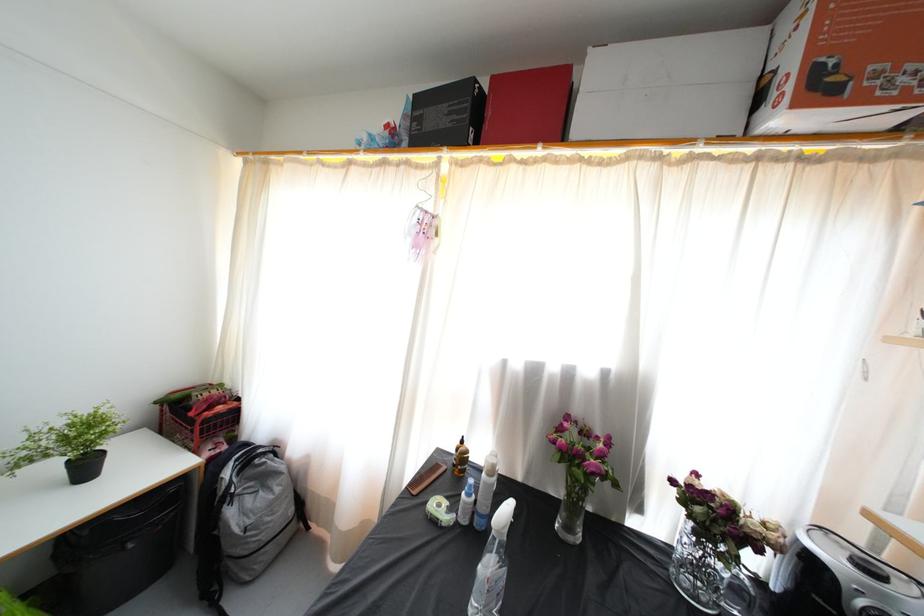
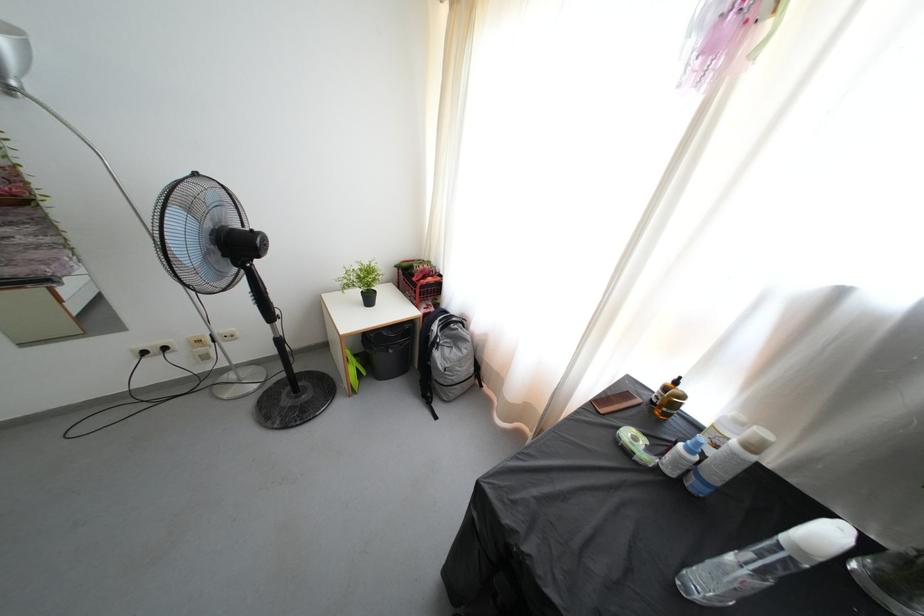
Locate, in the second image, the point that corresponds to point (484, 573) in the first image.

(736, 564)